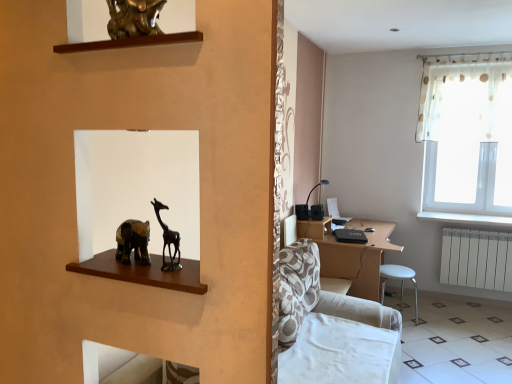
Question: From a real-world perspective, is white glossy tile at lower right located higher than brown wooden desk at center?

Choices:
 (A) no
 (B) yes

Answer: (A)

Question: From the image's perspective, would you say white glossy tile at lower right is positioned over brown wooden desk at center?

Choices:
 (A) yes
 (B) no

Answer: (B)

Question: From the image's perspective, is white glossy tile at lower right under brown wooden desk at center?

Choices:
 (A) yes
 (B) no

Answer: (A)

Question: Is the depth of white glossy tile at lower right greater than that of brown wooden desk at center?

Choices:
 (A) no
 (B) yes

Answer: (A)

Question: Is white glossy tile at lower right at the left side of brown wooden desk at center?

Choices:
 (A) no
 (B) yes

Answer: (A)

Question: Is white glossy tile at lower right far away from brown wooden desk at center?

Choices:
 (A) no
 (B) yes

Answer: (A)

Question: Is white painted wood at right taller than white plastic radiator at lower right?

Choices:
 (A) no
 (B) yes

Answer: (A)

Question: Considering the relative positions of white painted wood at right and white plastic radiator at lower right in the image provided, is white painted wood at right behind white plastic radiator at lower right?

Choices:
 (A) yes
 (B) no

Answer: (B)

Question: From the image's perspective, is white painted wood at right over white plastic radiator at lower right?

Choices:
 (A) yes
 (B) no

Answer: (A)

Question: Is white painted wood at right far from white plastic radiator at lower right?

Choices:
 (A) no
 (B) yes

Answer: (A)

Question: From a real-world perspective, is white painted wood at right beneath white plastic radiator at lower right?

Choices:
 (A) no
 (B) yes

Answer: (A)

Question: Considering the relative sizes of white painted wood at right and white plastic radiator at lower right in the image provided, is white painted wood at right shorter than white plastic radiator at lower right?

Choices:
 (A) no
 (B) yes

Answer: (B)

Question: Is white glossy tile at lower right next to matte black table lamp at center-right and touching it?

Choices:
 (A) no
 (B) yes

Answer: (A)